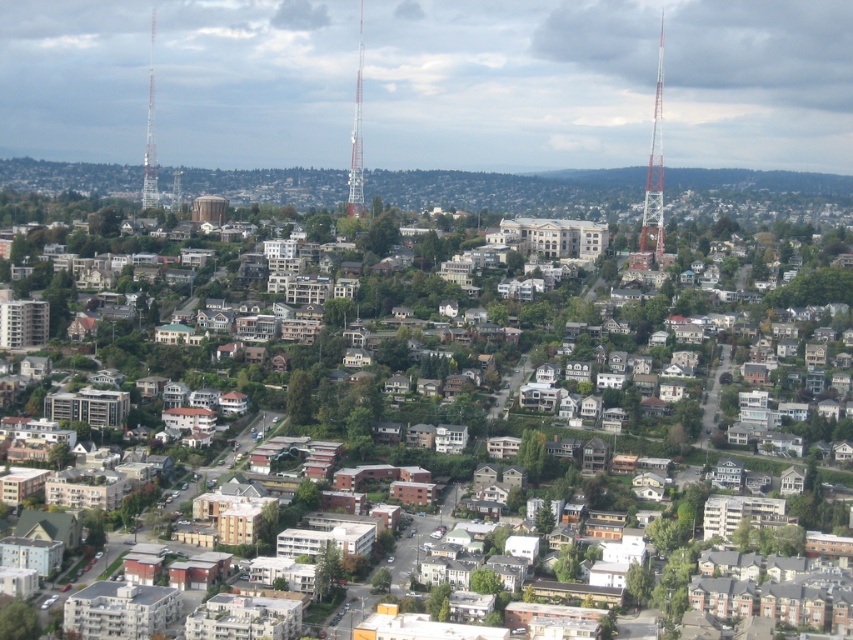
You are a drone operator tasked with capturing aerial footage. Your drone has a maximum flight range of 600 meters. You need to fly from your current position to the red painted metal tower at right to capture a close shot. Can your drone safely return to you after capturing the footage?

The distance between the red painted metal tower at right and the camera is 656.74 meters. Since the drone can only fly up to 600 meters, it cannot safely return as the round trip would exceed its range.

You are a drone operator trying to navigate between two communication towers in the urban area. The white painted metal tower at center and the metallic silver tower at left are both in your path. According to the aerial view, which tower is positioned to the east of the other?

The white painted metal tower at center is to the right of metallic silver tower at left, so the white painted metal tower at center is positioned to the east of the metallic silver tower at left.

In the scene shown: You are a drone operator flying over the urban area. You need to land your drone on the red painted metal tower at right. However, there is a metallic silver tower at left in the background. Which tower should you avoid flying towards to ensure a safe landing?

You should avoid flying towards the metallic silver tower at left because the red painted metal tower at right is in front of it, meaning the silver tower is further back and not the landing spot.